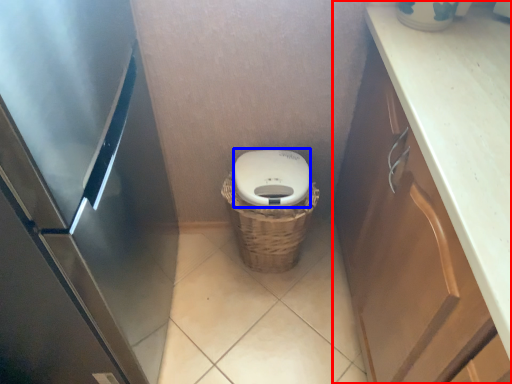
Question: Among these objects, which one is farthest to the camera, cabinetry (highlighted by a red box) or lid (highlighted by a blue box)?

Choices:
 (A) cabinetry
 (B) lid

Answer: (B)